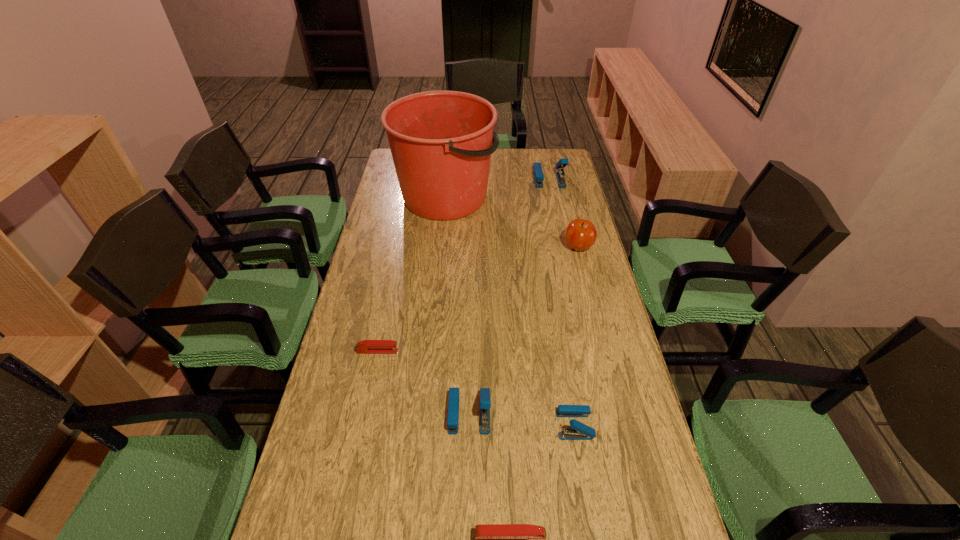
I want to click on the farther red stapler, so click(x=366, y=346).

Where is `vacant space situated 0.160m on the back of the tallest object`? This screenshot has height=540, width=960. vacant space situated 0.160m on the back of the tallest object is located at coordinates (450, 151).

Locate an element on the screen. This screenshot has width=960, height=540. vacant region located 0.170m on the front of the farthest stapler is located at coordinates (556, 211).

Find the location of `free spot located on the left of the apple`. free spot located on the left of the apple is located at coordinates (539, 247).

This screenshot has width=960, height=540. What are the coordinates of `free space located on the right of the second tallest stapler` in the screenshot? It's located at (559, 413).

The width and height of the screenshot is (960, 540). I want to click on free space located 0.200m on the back of the smallest blue stapler, so coord(563,349).

This screenshot has width=960, height=540. I want to click on free space located on the front-facing side of the shortest stapler, so click(x=468, y=351).

Identify the location of bucket present at the far edge. This screenshot has height=540, width=960. (441, 142).

You are a GUI agent. You are given a task and a screenshot of the screen. Output one action in this format:
    pyautogui.click(x=<x>, y=<y>)
    Task: Click on the stapler located in the far edge section of the desktop
    
    Given the screenshot: What is the action you would take?
    pyautogui.click(x=537, y=172)

Image resolution: width=960 pixels, height=540 pixels. I want to click on bucket present at the left edge, so click(x=441, y=142).